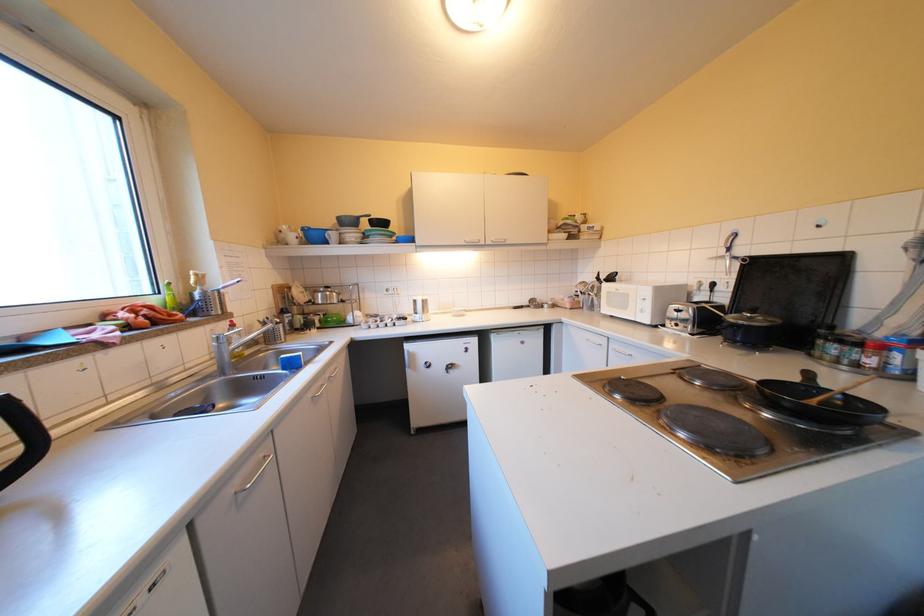
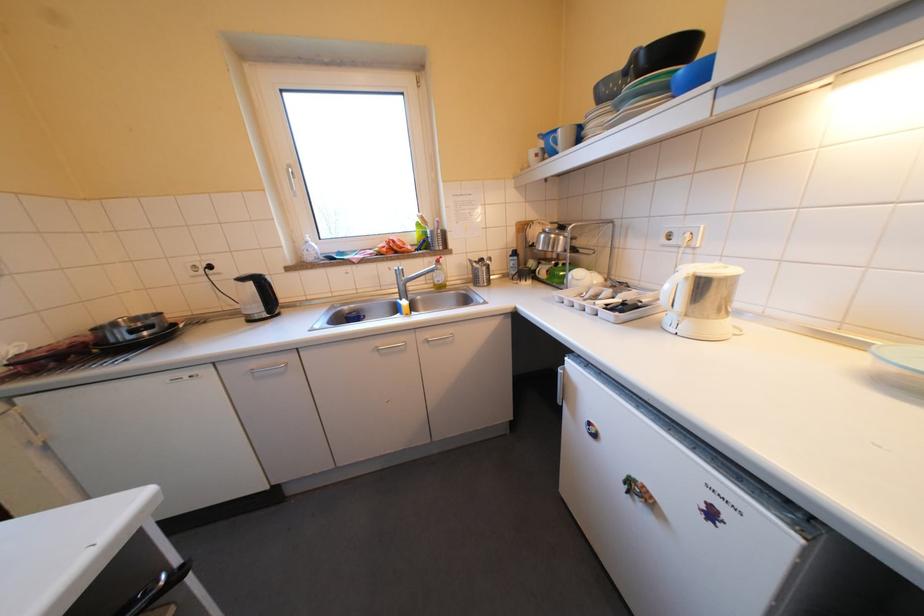
Where in the second image is the point corresponding to the point at 325,395 from the first image?

(391, 346)